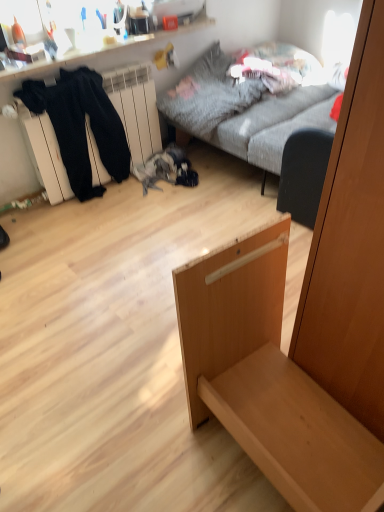
Question: Looking at their shapes, would you say light wood drawer at center is wider or thinner than gray fabric couch at upper center?

Choices:
 (A) thin
 (B) wide

Answer: (A)

Question: From a real-world perspective, is light wood drawer at center physically located above or below gray fabric couch at upper center?

Choices:
 (A) above
 (B) below

Answer: (A)

Question: Which object is the farthest from the black cotton pants at left?

Choices:
 (A) light wood drawer at center
 (B) gray fabric couch at upper center
 (C) black fabric armchair at center

Answer: (A)

Question: Estimate the real-world distances between objects in this image. Which object is closer to the gray fabric couch at upper center?

Choices:
 (A) black cotton pants at left
 (B) black fabric armchair at center
 (C) light wood drawer at center

Answer: (B)